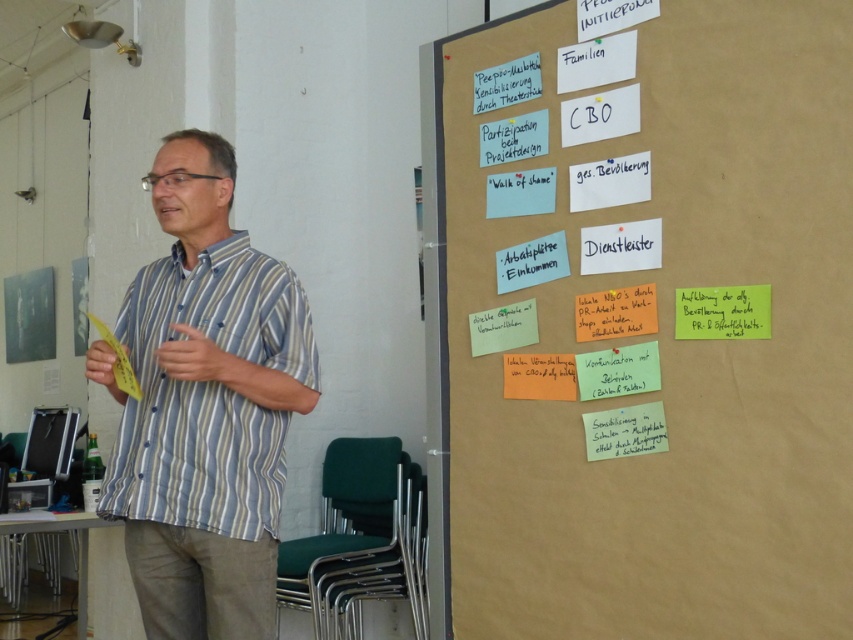
Question: Among these points, which one is farthest from the camera?

Choices:
 (A) (300, 368)
 (B) (457, 161)

Answer: (B)

Question: Is white paper notes at upper right bigger than striped cotton shirt at center?

Choices:
 (A) no
 (B) yes

Answer: (B)

Question: Which point is closer to the camera?

Choices:
 (A) striped cotton shirt at center
 (B) white paper notes at upper right

Answer: (B)

Question: Considering the relative positions of white paper notes at upper right and striped cotton shirt at center in the image provided, where is white paper notes at upper right located with respect to striped cotton shirt at center?

Choices:
 (A) left
 (B) right

Answer: (B)

Question: Does white paper notes at upper right have a larger size compared to striped cotton shirt at center?

Choices:
 (A) yes
 (B) no

Answer: (A)

Question: Which of the following is the closest to the observer?

Choices:
 (A) striped cotton shirt at center
 (B) white paper notes at upper right

Answer: (B)